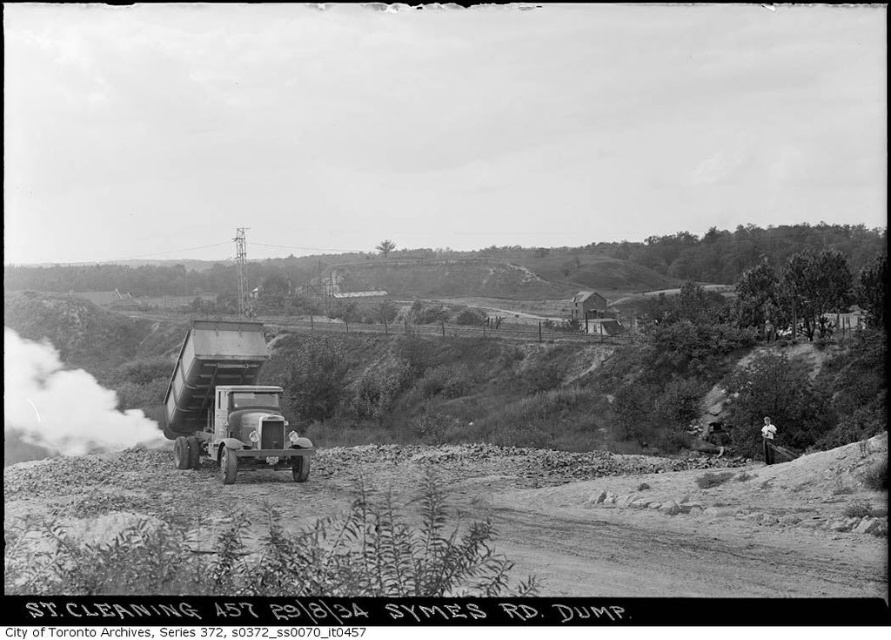
You are a delivery driver who needs to navigate the dirt track at lower center to reach the unloading zone. Given that the metallic silver trailer truck at center is currently blocking the path, can you pass around it on either side?

The dirt track at lower center is located below the metallic silver trailer truck at center, meaning the truck is positioned above the track. Therefore, you can drive around the truck on either side to access the dirt track at lower center.

You are a delivery driver operating a truck that is 4 meters long. You need to back up your truck onto the dirt track at lower center from the metallic silver trailer truck at center. Is there enough space to do this maneuver?

The dirt track at lower center is 10.33 meters away from the metallic silver trailer truck at center. Since the truck is 4 meters long, there is sufficient space to back up the truck onto the dirt track as the distance between them is more than the truck length.